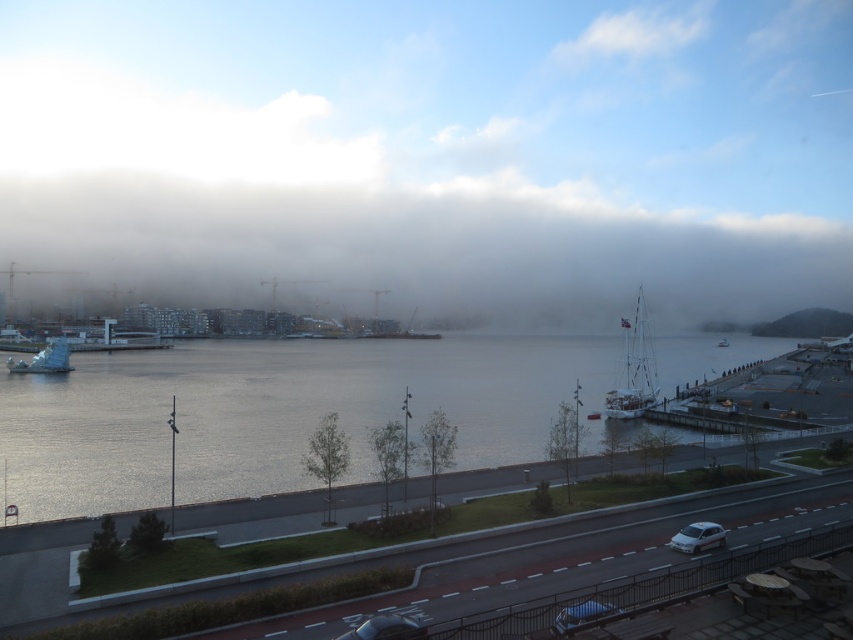
Between glistening water at center and white matte sculpture at lower left, which one has less height?

white matte sculpture at lower left

Does glistening water at center appear on the left side of white matte sculpture at lower left?

Incorrect, glistening water at center is not on the left side of white matte sculpture at lower left.

This screenshot has width=853, height=640. What do you see at coordinates (276, 413) in the screenshot?
I see `glistening water at center` at bounding box center [276, 413].

Identify the location of glistening water at center. (276, 413).

Does white fluffy fog at center appear under white matte sailboat at right?

No.

Who is positioned more to the right, white fluffy fog at center or white matte sailboat at right?

Positioned to the right is white matte sailboat at right.

Image resolution: width=853 pixels, height=640 pixels. Describe the element at coordinates (436, 154) in the screenshot. I see `white fluffy fog at center` at that location.

Where is `white fluffy fog at center`? The image size is (853, 640). white fluffy fog at center is located at coordinates (436, 154).

Who is more forward, (364,461) or (718,540)?

Positioned in front is point (718,540).

Who is taller, glistening water at center or white glossy car at lower right?

With more height is glistening water at center.

The width and height of the screenshot is (853, 640). What do you see at coordinates (276, 413) in the screenshot?
I see `glistening water at center` at bounding box center [276, 413].

Identify the location of glistening water at center. This screenshot has height=640, width=853. (276, 413).